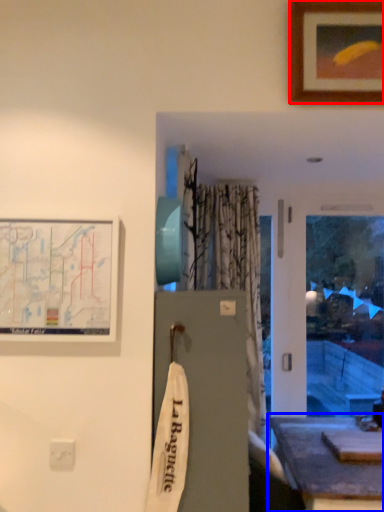
Question: Which point is further to the camera, picture frame (highlighted by a red box) or table (highlighted by a blue box)?

Choices:
 (A) picture frame
 (B) table

Answer: (B)